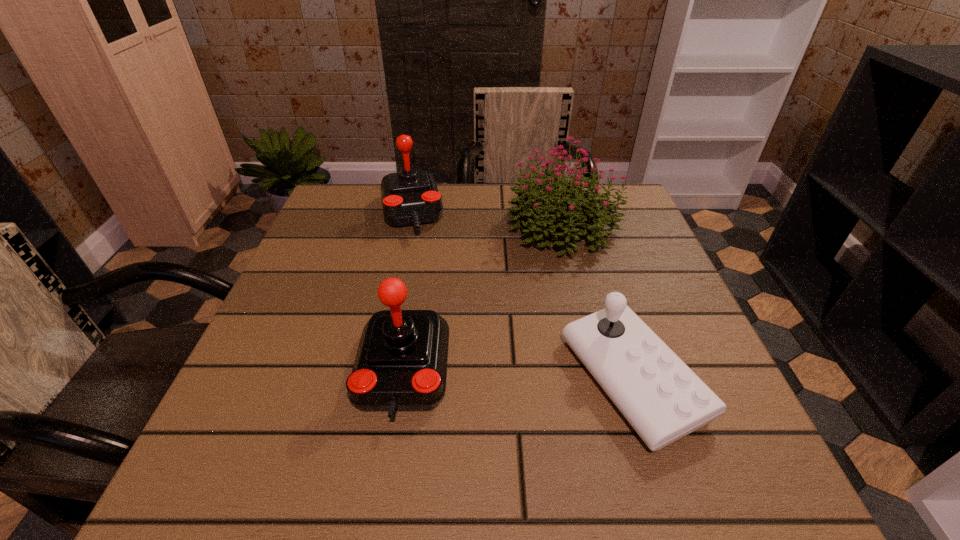
This screenshot has width=960, height=540. What are the coordinates of `object located at the left edge` in the screenshot? It's located at (409, 197).

Find the location of a particular element. The image size is (960, 540). bouquet located at the right edge is located at coordinates (535, 199).

I want to click on joystick present at the right edge, so click(663, 400).

Image resolution: width=960 pixels, height=540 pixels. In order to click on object present at the far left corner in this screenshot , I will do `click(409, 197)`.

The height and width of the screenshot is (540, 960). What are the coordinates of `object at the far right corner` in the screenshot? It's located at (535, 199).

I want to click on object at the near right corner, so click(663, 400).

At what (x,y) coordinates should I click in order to perform the action: click on vacant space at the far edge of the desktop. Please return your answer as a coordinate pair (x, y). This screenshot has height=540, width=960. Looking at the image, I should click on (512, 206).

In the image, there is a desktop. Identify the location of free space at the left edge. The image size is (960, 540). coord(325,267).

Find the location of a particular element. The image size is (960, 540). vacant space at the right edge is located at coordinates (598, 270).

This screenshot has height=540, width=960. In order to click on vacant space at the far left corner of the desktop in this screenshot , I will do `click(346, 198)`.